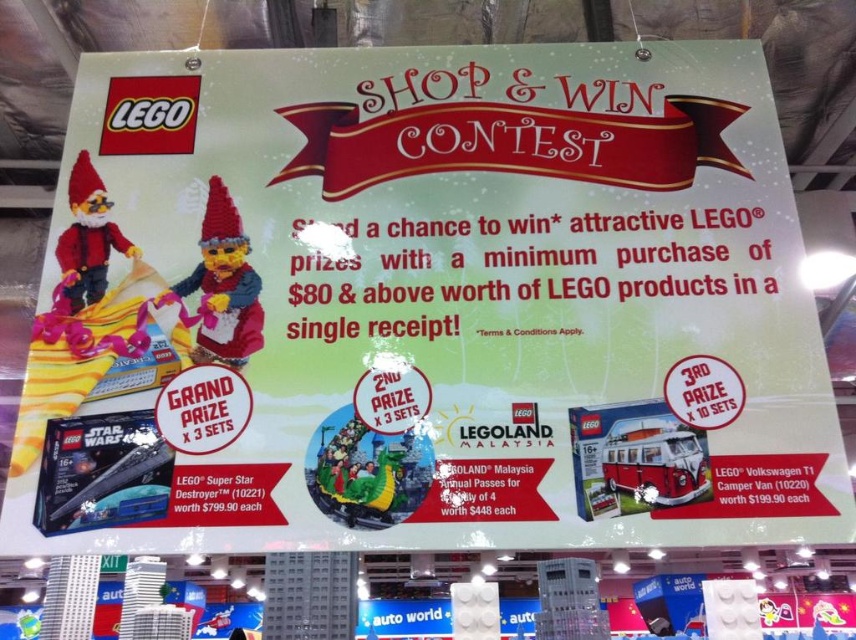
Between knitted woolen gnome at center and matte plastic gnome at upper left, which one has less height?

matte plastic gnome at upper left is shorter.

Is knitted woolen gnome at center below matte plastic gnome at upper left?

Yes.

Does point (238, 317) come in front of point (116, 225)?

Yes, it is in front of point (116, 225).

Find the location of `knitted woolen gnome at center`. knitted woolen gnome at center is located at coordinates (221, 285).

Who is higher up, red matte lego volkswagen t1 camper van at center or matte plastic gnome at upper left?

matte plastic gnome at upper left

Locate an element on the screen. This screenshot has height=640, width=856. red matte lego volkswagen t1 camper van at center is located at coordinates (654, 464).

Identify the location of red matte lego volkswagen t1 camper van at center. Image resolution: width=856 pixels, height=640 pixels. tap(654, 464).

Can you confirm if knitted woolen gnome at center is positioned above red matte lego volkswagen t1 camper van at center?

Yes, knitted woolen gnome at center is above red matte lego volkswagen t1 camper van at center.

Between point (244, 310) and point (634, 442), which one is positioned in front?

Point (634, 442) is in front.

Find the location of `knitted woolen gnome at center`. knitted woolen gnome at center is located at coordinates click(x=221, y=285).